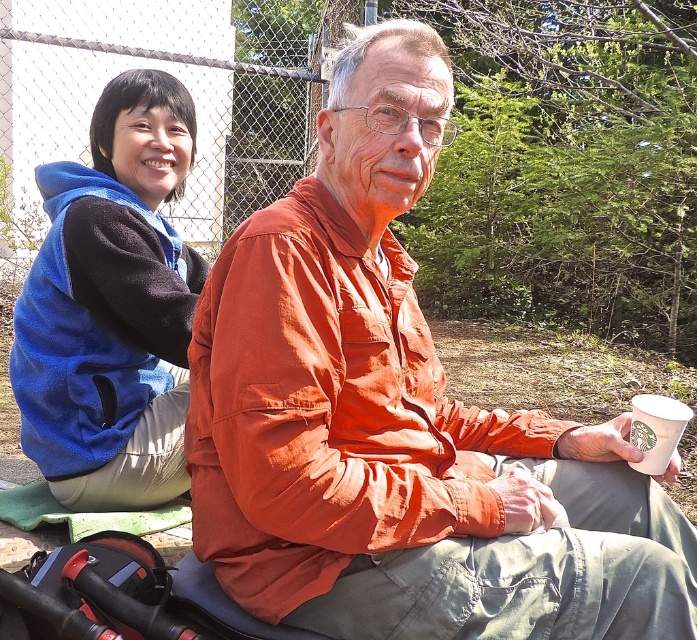
Which is more to the right, blue fleece vest at upper left or white paper cup at lower right?

white paper cup at lower right

Who is higher up, blue fleece vest at upper left or white paper cup at lower right?

Positioned higher is blue fleece vest at upper left.

Who is more distant from viewer, (162, 444) or (680, 406)?

The point (162, 444) is more distant.

Where is `blue fleece vest at upper left`? blue fleece vest at upper left is located at coordinates (112, 307).

Describe the element at coordinates (399, 419) in the screenshot. I see `orange cotton shirt at center` at that location.

In the scene shown: Can you confirm if orange cotton shirt at center is shorter than white paper cup at lower right?

No.

Which is behind, point (329, 426) or point (659, 406)?

Point (659, 406)

The height and width of the screenshot is (640, 697). Identify the location of orange cotton shirt at center. (399, 419).

Who is positioned more to the left, orange cotton shirt at center or blue fleece vest at upper left?

blue fleece vest at upper left is more to the left.

Is point (602, 444) less distant than point (164, 262)?

That is True.

Does point (358, 157) come closer to viewer compared to point (56, 419)?

Yes, it is.

In order to click on orange cotton shirt at center in this screenshot , I will do `click(399, 419)`.